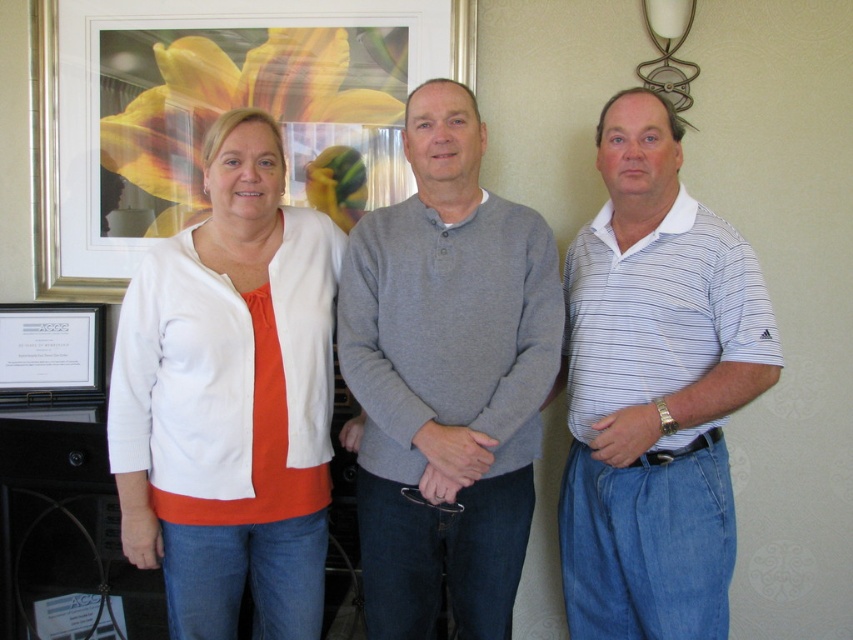
You are standing in the room where the three people are. You want to place a small plant between the two points labeled as point (229, 248) and point (80, 358). Which point should the plant be closer to to ensure it is in front of the other point?

The plant should be closer to point (229, 248) because it is in front of point (80, 358).

You are organizing a photo shoot and need to ensure that the white matte cardigan at center and the white paper at left are visible in the final image. Based on their positions, which object is closer to the camera?

The white matte cardigan at center is closer to the camera because it is in front of the white paper at left.

You are a photographer standing 5 feet away from the camera. You want to take a picture of the white cotton cardigan at center without moving the camera. Can you reach the cardigan to adjust it?

The white cotton cardigan at center and camera are 5.48 feet apart from each other. Since you are already 5 feet away from the camera, the total distance to the cardigan would be 5.48 feet. You might need to stretch or take a step forward to reach it.